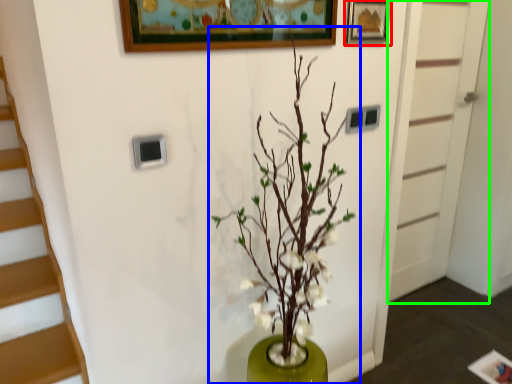
Question: Estimate the real-world distances between objects in this image. Which object is closer to picture frame (highlighted by a red box), houseplant (highlighted by a blue box) or door (highlighted by a green box)?

Choices:
 (A) houseplant
 (B) door

Answer: (A)